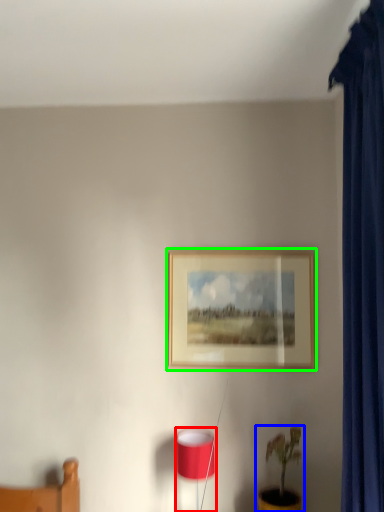
Question: Which is farther away from table lamp (highlighted by a red box)? houseplant (highlighted by a blue box) or picture frame (highlighted by a green box)?

Choices:
 (A) houseplant
 (B) picture frame

Answer: (B)